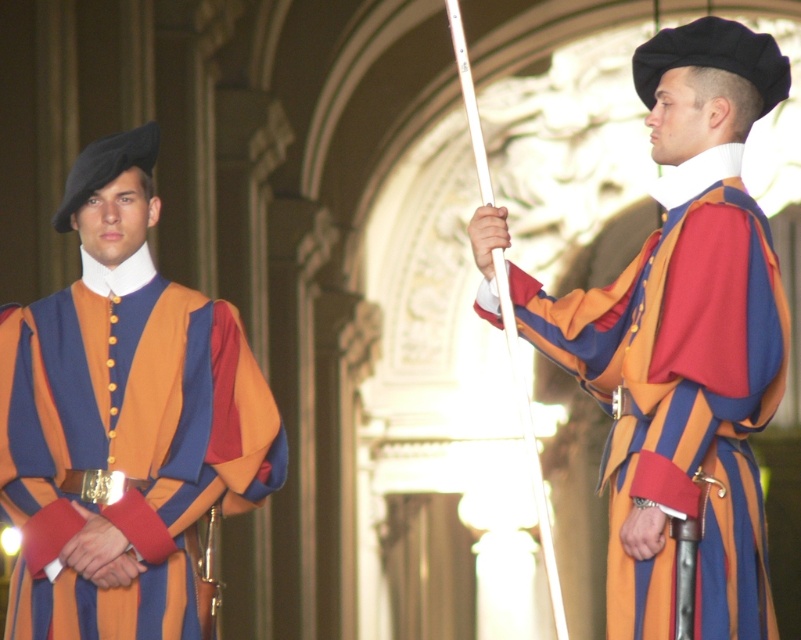
The height and width of the screenshot is (640, 801). Identify the location of matte striped robe at center. (685, 340).

The height and width of the screenshot is (640, 801). I want to click on matte striped robe at center, so click(x=685, y=340).